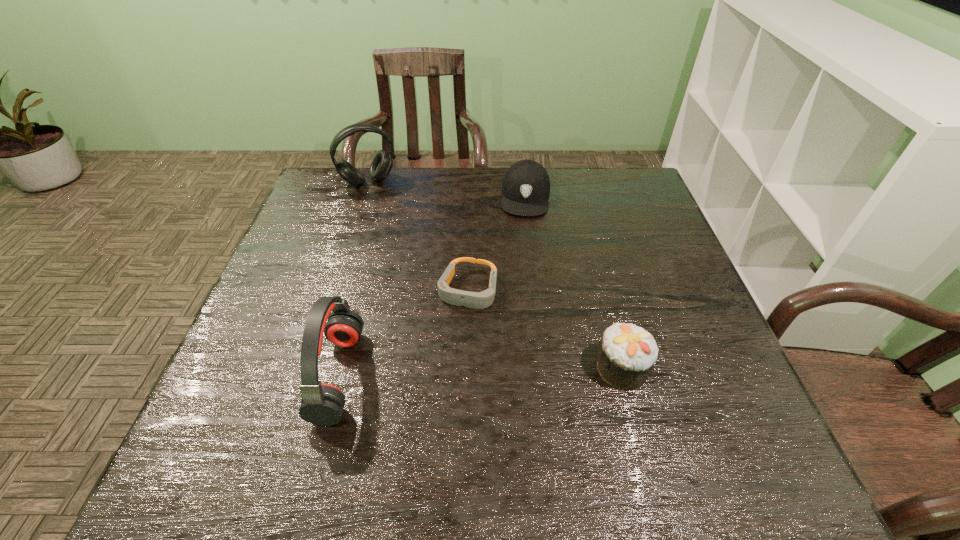
Locate an element on the screen. This screenshot has width=960, height=540. vacant spot on the desktop that is between the earphone and the rightmost object and is positioned on the front-facing side of the fourth object from left to right is located at coordinates (509, 371).

The image size is (960, 540). Find the location of `vacant space on the desktop that is between the earphone and the rightmost object and is positioned on the front and back of the third nearest object`. vacant space on the desktop that is between the earphone and the rightmost object and is positioned on the front and back of the third nearest object is located at coordinates (440, 373).

Find the location of a particular element. Image resolution: width=960 pixels, height=540 pixels. free space on the desktop that is between the earphone and the cupcake and is positioned on the earcups of the headset is located at coordinates (468, 372).